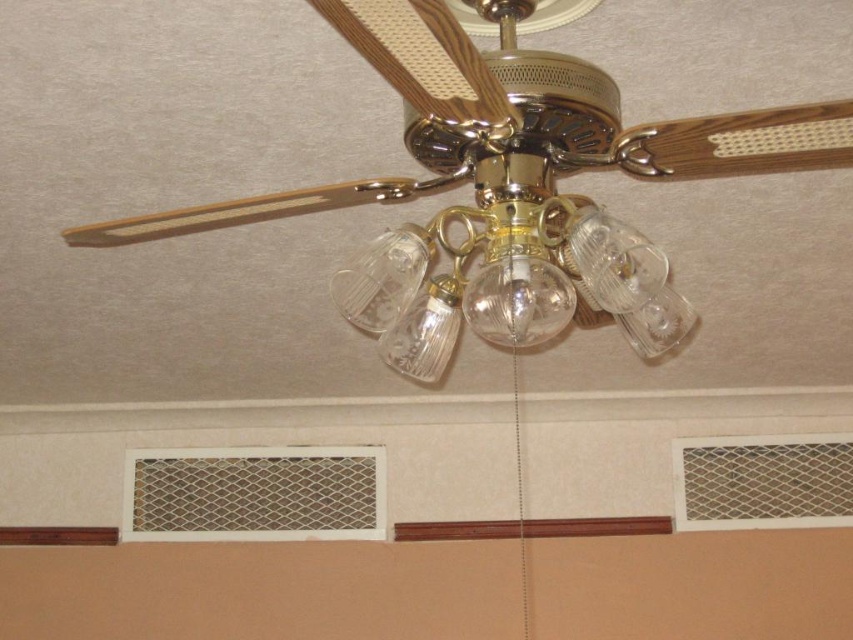
Question: Is gold/wooden ceiling fan at center above clear glass light fixture at center?

Choices:
 (A) no
 (B) yes

Answer: (B)

Question: Can you confirm if gold/wooden ceiling fan at center is positioned above clear glass light fixture at center?

Choices:
 (A) yes
 (B) no

Answer: (A)

Question: Among these objects, which one is farthest from the camera?

Choices:
 (A) gold/wooden ceiling fan at center
 (B) clear glass light fixture at center

Answer: (B)

Question: Does gold/wooden ceiling fan at center have a greater width compared to clear glass light fixture at center?

Choices:
 (A) yes
 (B) no

Answer: (A)